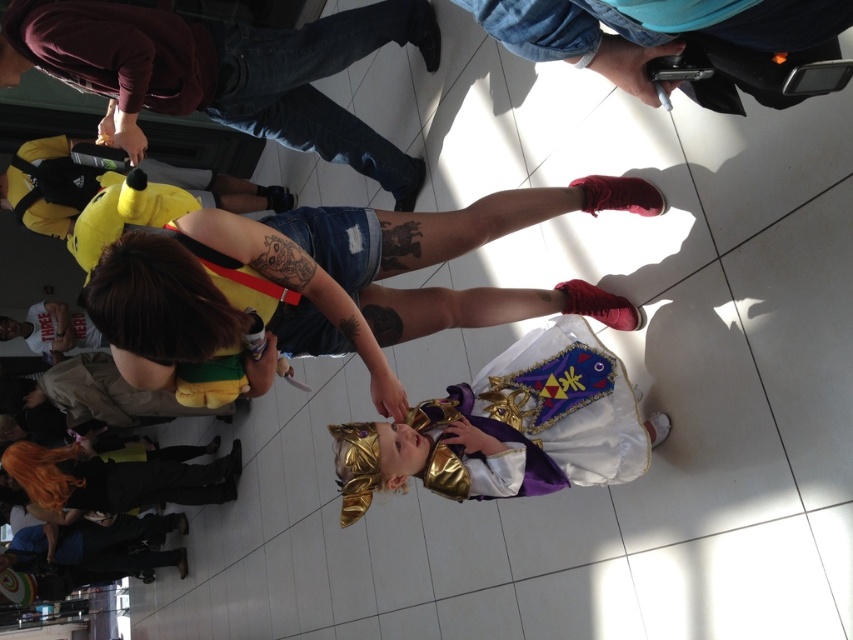
You are a photographer at the event and want to capture a photo of both the denim shorts at center and blue denim jeans at upper center in the same frame. Based on their positions, which one should you focus on first to ensure both are in the frame?

The denim shorts at center should be focused on first since it is to the left of the blue denim jeans at upper center, allowing the photographer to adjust the frame to include both.

You are a photographer at the event and want to capture a photo of both the blue denim jeans at upper center and the yellow plush toy at left. Which object should you focus on first to ensure both are in the frame?

You should focus on the blue denim jeans at upper center first since it is closer to the viewer than the yellow plush toy at left, ensuring both are in the frame by adjusting the camera angle accordingly.

You are a fashion designer observing the clothing items in the image. Which clothing item has a greater width between the denim shorts at center and the blue denim jeans at upper center?

The denim shorts at center has a greater width than the blue denim jeans at upper center according to the description.